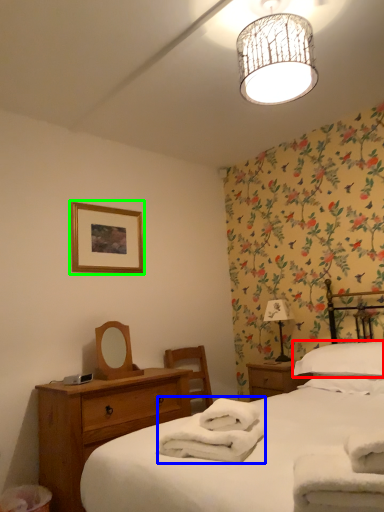
Question: Which is nearer to the pillow (highlighted by a red box)? bath towel (highlighted by a blue box) or picture frame (highlighted by a green box).

Choices:
 (A) bath towel
 (B) picture frame

Answer: (A)